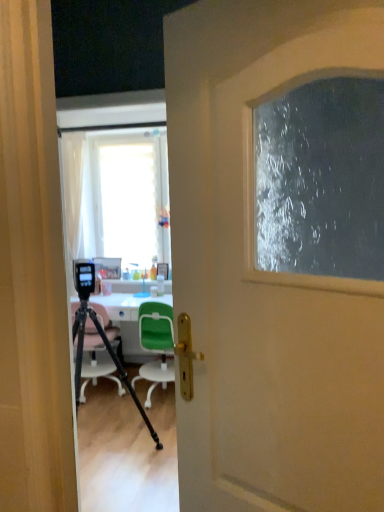
Question: From a real-world perspective, relative to green plastic chair at center, the second chair positioned from the left, is white glossy desk at center vertically above or below?

Choices:
 (A) above
 (B) below

Answer: (B)

Question: From their relative heights in the image, would you say white glossy desk at center is taller or shorter than green plastic chair at center, the second chair positioned from the left?

Choices:
 (A) tall
 (B) short

Answer: (B)

Question: Which of these objects is positioned closest to the white matte door at center?

Choices:
 (A) pink plastic chair at center, the second chair from the right
 (B) green plastic chair at center, the second chair positioned from the left
 (C) white glossy desk at center
 (D) black matte tripod at center
 (E) translucent plastic bottle at center

Answer: (D)

Question: Which object is positioned closest to the black matte tripod at center?

Choices:
 (A) green plastic chair at center, the second chair positioned from the left
 (B) translucent plastic bottle at center
 (C) pink plastic chair at center, the second chair from the right
 (D) white glossy desk at center
 (E) white matte door at center

Answer: (C)